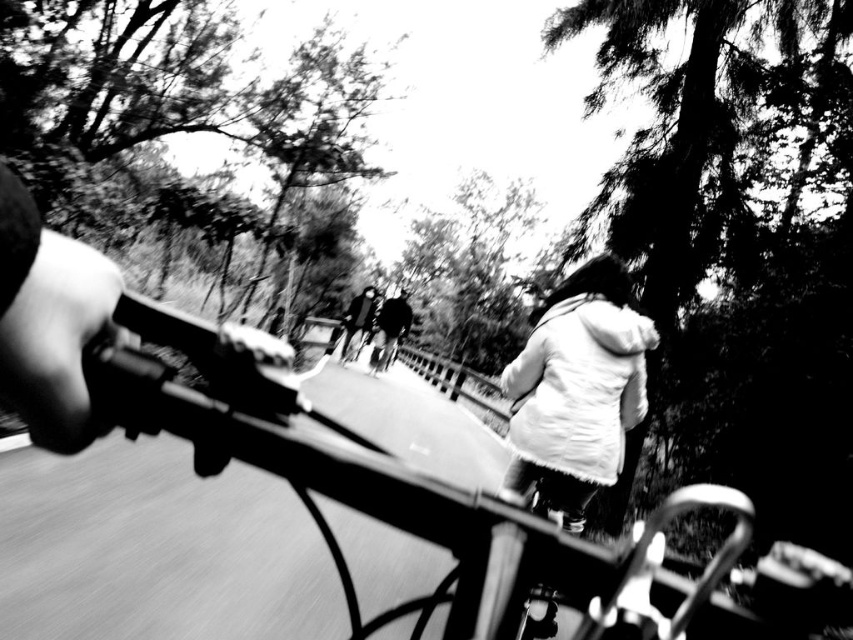
You are riding a bicycle and looking at the two points marked in the image. Which point, point [607,468] or point [367,289], is nearer to you?

Point [607,468] is closer to the viewer than point [367,289].